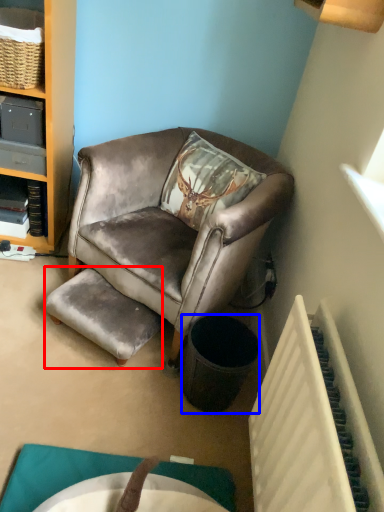
Question: Which object appears farthest to the camera in this image, stool (highlighted by a red box) or trash bin/can (highlighted by a blue box)?

Choices:
 (A) stool
 (B) trash bin/can

Answer: (A)